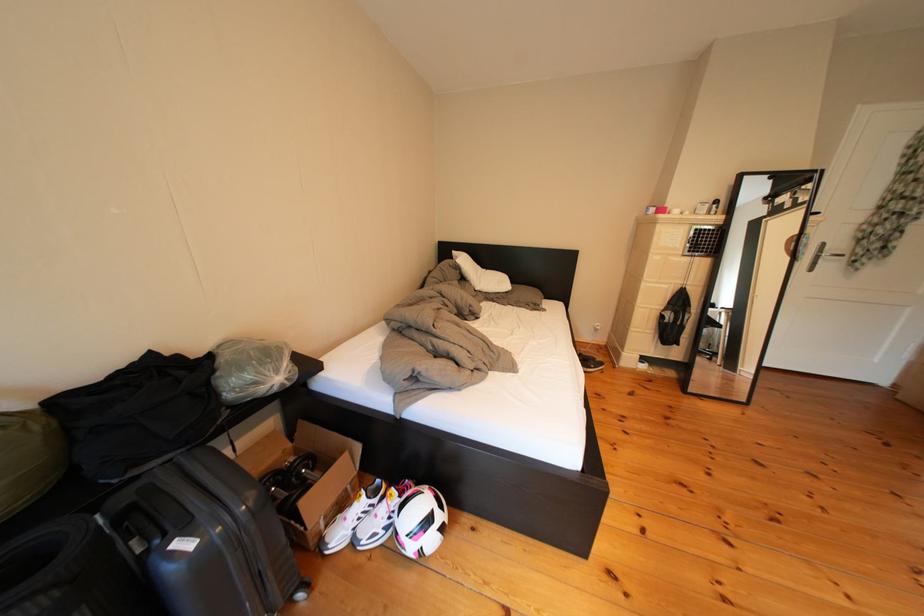
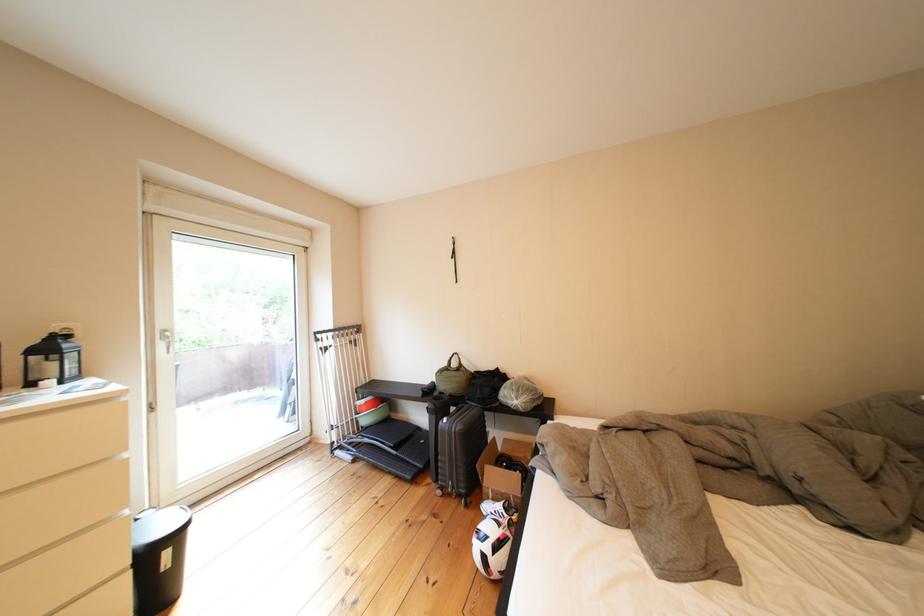
Question: I am providing you with two images of the same scene from different viewpoints. Please identify which objects are invisible in image2.

Choices:
 (A) white drawer pull
 (B) black wall strap
 (C) green bag handle
 (D) none of these

Answer: (D)